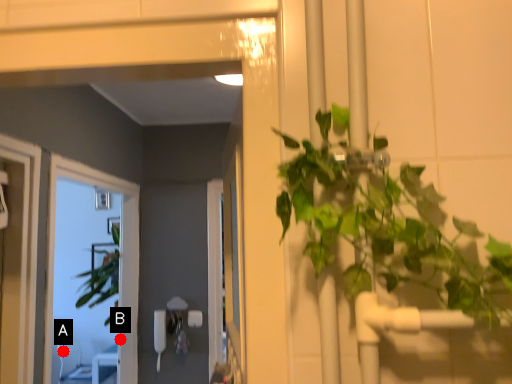
Question: Two points are circled on the image, labeled by A and B beside each circle. Among these points, which one is farthest from the camera?

Choices:
 (A) A is further
 (B) B is further

Answer: (A)